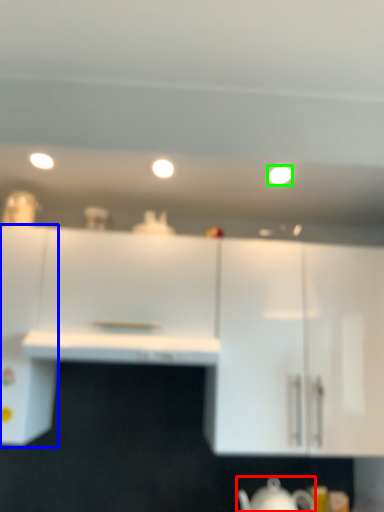
Question: Considering the real-world distances, which object is closest to jug (highlighted by a red box)? cabinetry (highlighted by a blue box) or lighting (highlighted by a green box).

Choices:
 (A) cabinetry
 (B) lighting

Answer: (A)